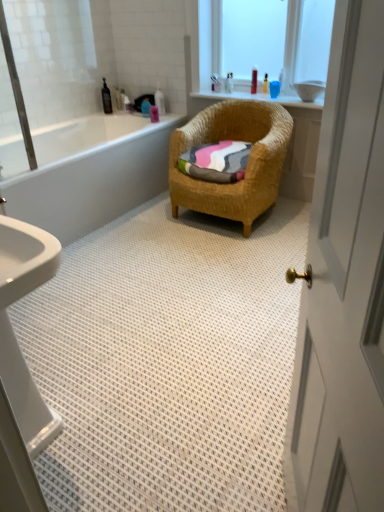
At what (x,y) coordinates should I click in order to perform the action: click on empty space that is ontop of multicolored woven towel at center (from a real-world perspective). Please return your answer as a coordinate pair (x, y). Looking at the image, I should click on (228, 147).